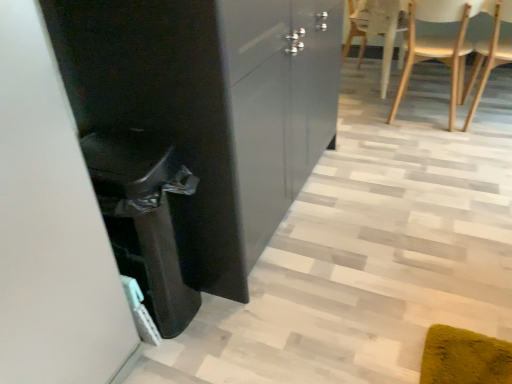
Question: Are white wood chair at upper right, which is the 2th chair from right to left, and wooden at right, positioned as the first chair in right-to-left order, beside each other?

Choices:
 (A) yes
 (B) no

Answer: (B)

Question: Is white wood chair at upper right, which is the 2th chair from right to left, to the right of wooden at right, which is the 2th chair from left to right, from the viewer's perspective?

Choices:
 (A) no
 (B) yes

Answer: (A)

Question: From a real-world perspective, is white wood chair at upper right, which is the 2th chair from right to left, physically above wooden at right, which is the 2th chair from left to right?

Choices:
 (A) yes
 (B) no

Answer: (B)

Question: Considering the relative sizes of white wood chair at upper right, which is the 2th chair from right to left, and wooden at right, positioned as the first chair in right-to-left order, in the image provided, is white wood chair at upper right, which is the 2th chair from right to left, taller than wooden at right, positioned as the first chair in right-to-left order,?

Choices:
 (A) no
 (B) yes

Answer: (B)

Question: Is wooden at right, positioned as the first chair in right-to-left order, a part of white wood chair at upper right, which is the 2th chair from right to left?

Choices:
 (A) no
 (B) yes

Answer: (A)

Question: Based on their sizes in the image, would you say white wood chair at upper right, which is the 1th chair from left to right, is bigger or smaller than glossy black cabinet at center?

Choices:
 (A) small
 (B) big

Answer: (A)

Question: Is white wood chair at upper right, which is the 2th chair from right to left, taller or shorter than glossy black cabinet at center?

Choices:
 (A) short
 (B) tall

Answer: (A)

Question: Considering their positions, is white wood chair at upper right, which is the 2th chair from right to left, located in front of or behind glossy black cabinet at center?

Choices:
 (A) front
 (B) behind

Answer: (B)

Question: Considering the positions of white wood chair at upper right, which is the 2th chair from right to left, and glossy black cabinet at center in the image, is white wood chair at upper right, which is the 2th chair from right to left, wider or thinner than glossy black cabinet at center?

Choices:
 (A) thin
 (B) wide

Answer: (A)

Question: Considering their positions, is glossy black cabinet at center located in front of or behind wooden at right, positioned as the first chair in right-to-left order?

Choices:
 (A) front
 (B) behind

Answer: (A)

Question: Looking at their shapes, would you say glossy black cabinet at center is wider or thinner than wooden at right, which is the 2th chair from left to right?

Choices:
 (A) wide
 (B) thin

Answer: (A)

Question: In the image, is glossy black cabinet at center on the left side or the right side of wooden at right, positioned as the first chair in right-to-left order?

Choices:
 (A) right
 (B) left

Answer: (B)

Question: Is point (176, 66) closer or farther from the camera than point (484, 64)?

Choices:
 (A) closer
 (B) farther

Answer: (A)

Question: Based on their sizes in the image, would you say white wood chair at upper right, which is the 1th chair from left to right, is bigger or smaller than wooden at right, which is the 2th chair from left to right?

Choices:
 (A) big
 (B) small

Answer: (A)

Question: Is point (420, 8) closer or farther from the camera than point (504, 56)?

Choices:
 (A) farther
 (B) closer

Answer: (A)